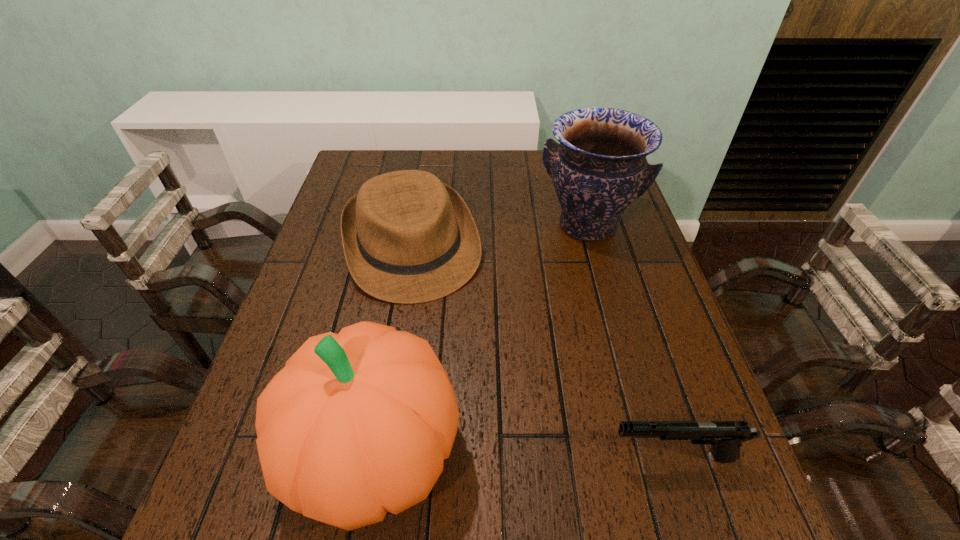
You are a GUI agent. You are given a task and a screenshot of the screen. Output one action in this format:
    pyautogui.click(x=<x>, y=<y>)
    Task: Click on the vacant space at the right edge of the desktop
    
    Given the screenshot: What is the action you would take?
    pyautogui.click(x=613, y=286)

Identify the location of free space that is in between the pottery and the gun. (630, 341).

Locate an element on the screen. The height and width of the screenshot is (540, 960). vacant space that's between the pottery and the third tallest object is located at coordinates (500, 235).

Identify the location of free space between the pottery and the gun. (630, 341).

This screenshot has height=540, width=960. I want to click on empty space between the pottery and the fedora, so click(500, 235).

You are a GUI agent. You are given a task and a screenshot of the screen. Output one action in this format:
    pyautogui.click(x=<x>, y=<y>)
    Task: Click on the vacant area that lies between the pottery and the third tallest object
    This screenshot has height=540, width=960.
    Given the screenshot: What is the action you would take?
    pyautogui.click(x=500, y=235)

I want to click on free space between the shortest object and the pottery, so click(630, 341).

Find the location of `free point between the pottery and the shortest object`. free point between the pottery and the shortest object is located at coordinates (630, 341).

The image size is (960, 540). Find the location of `the closest object to the pumpkin`. the closest object to the pumpkin is located at coordinates (408, 238).

Identify the location of object that is the nearest to the shortest object. (357, 424).